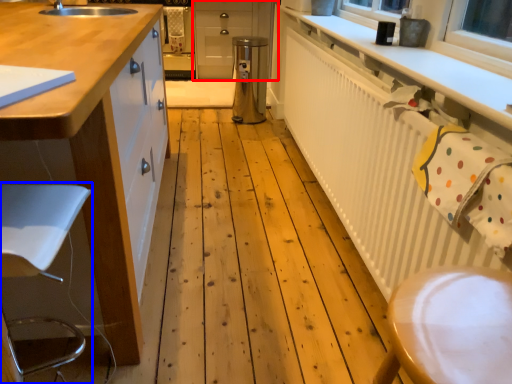
Question: Which of the following is the closest to the observer, cabinetry (highlighted by a red box) or swivel chair (highlighted by a blue box)?

Choices:
 (A) cabinetry
 (B) swivel chair

Answer: (B)